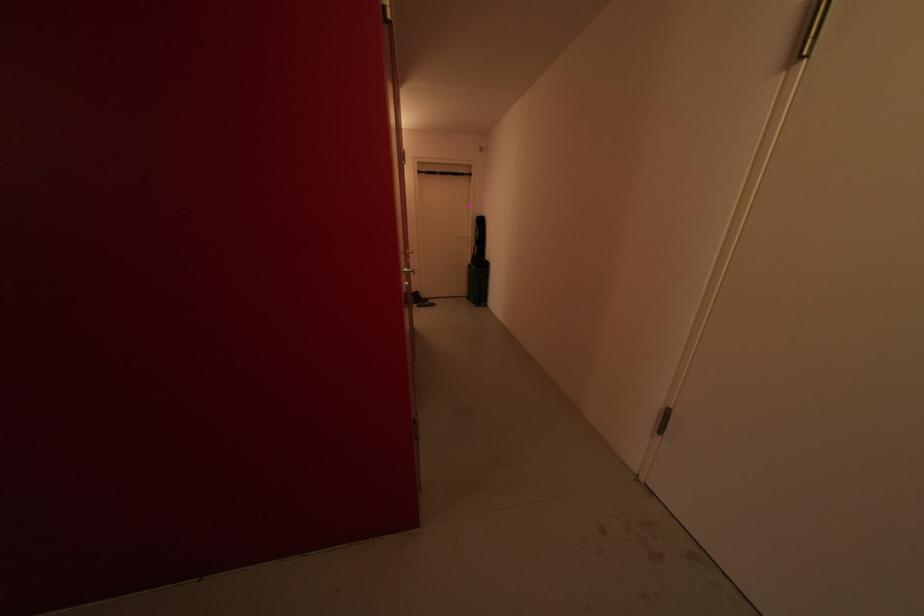
In order to click on white door handle in this screenshot , I will do `click(453, 237)`.